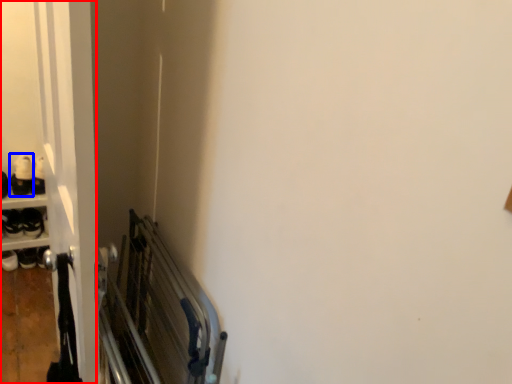
Question: Which object is closer to the camera taking this photo, door (highlighted by a red box) or footwear (highlighted by a blue box)?

Choices:
 (A) door
 (B) footwear

Answer: (A)